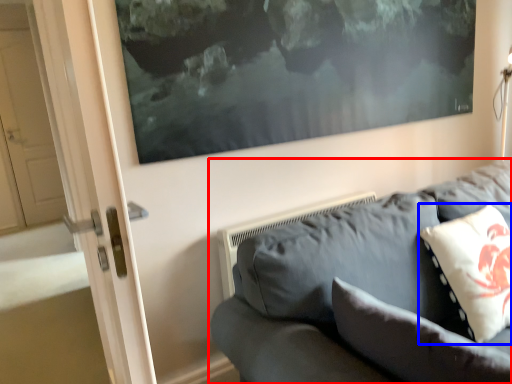
Question: Among these objects, which one is farthest to the camera, studio couch (highlighted by a red box) or pillow (highlighted by a blue box)?

Choices:
 (A) studio couch
 (B) pillow

Answer: (B)